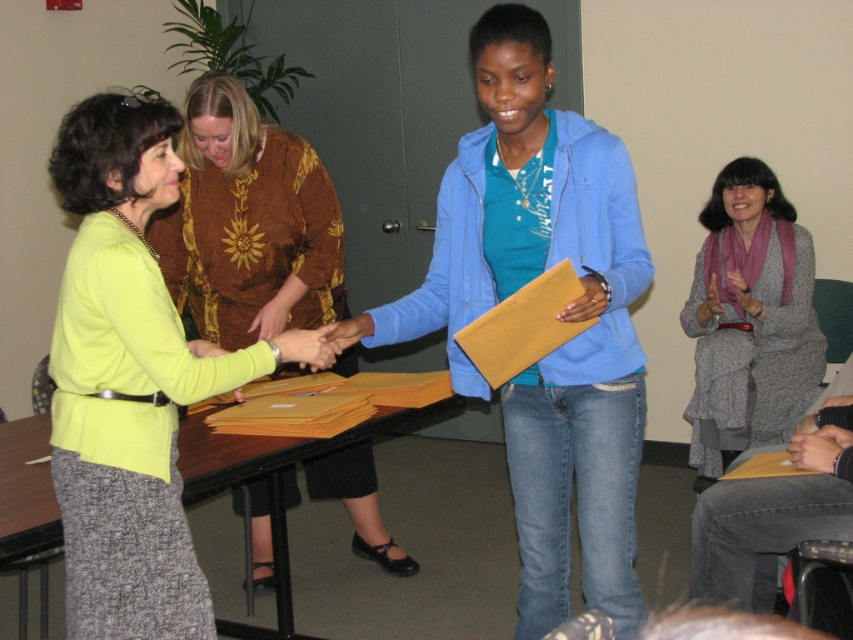
Question: Which of the following is the closest to the observer?

Choices:
 (A) (149, 298)
 (B) (241, 189)
 (C) (21, 512)

Answer: (A)

Question: Is matte yellow sweater at center wider than gray woolen sweater at upper right?

Choices:
 (A) yes
 (B) no

Answer: (A)

Question: Which of the following is the closest to the observer?

Choices:
 (A) matte green sweater at left
 (B) blue matte jacket at center

Answer: (A)

Question: Where is matte green sweater at left located in relation to gray woolen sweater at upper right in the image?

Choices:
 (A) right
 (B) left

Answer: (B)

Question: Does matte green sweater at left have a greater width compared to matte yellow sweater at center?

Choices:
 (A) yes
 (B) no

Answer: (B)

Question: Estimate the real-world distances between objects in this image. Which object is farther from the matte yellow sweater at center?

Choices:
 (A) wooden table at center
 (B) gray woolen sweater at upper right

Answer: (B)